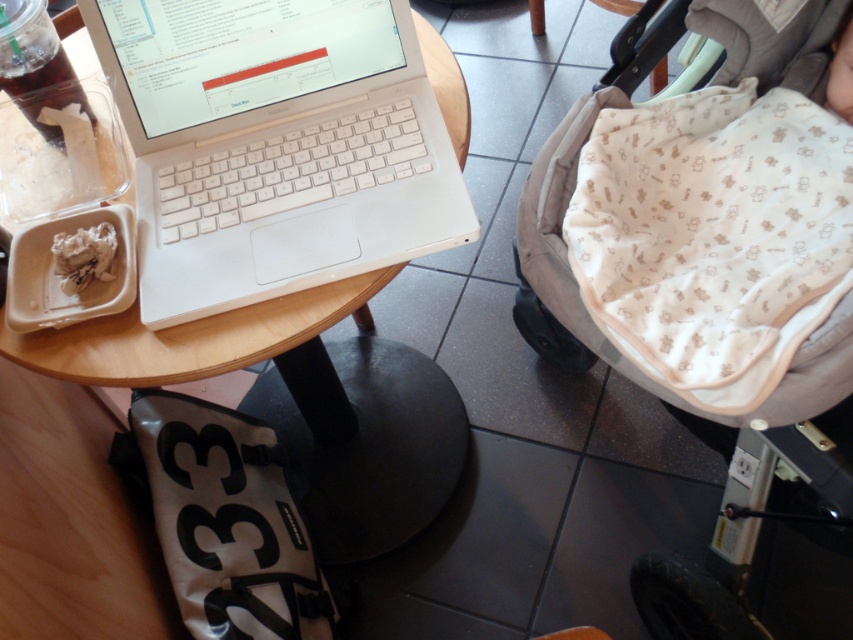
From the picture: Measure the distance between white plastic laptop at center and white crumpled paper at left.

A distance of 8.08 inches exists between white plastic laptop at center and white crumpled paper at left.

Locate an element on the screen. white plastic laptop at center is located at coordinates (276, 145).

This screenshot has height=640, width=853. I want to click on white plastic laptop at center, so point(276,145).

Locate an element on the screen. white plastic laptop at center is located at coordinates [x=276, y=145].

Between white plastic laptop at center and beige fabric baby carriage at center, which one appears on the left side from the viewer's perspective?

white plastic laptop at center

Between white plastic laptop at center and beige fabric baby carriage at center, which one is positioned lower?

beige fabric baby carriage at center is lower down.

Measure the distance between point (381, 40) and camera.

Point (381, 40) is 35.18 inches from camera.

I want to click on white plastic laptop at center, so click(276, 145).

Is beige fabric baby carriage at center thinner than white crumpled paper at left?

No.

In the scene shown: Is beige fabric baby carriage at center wider than white crumpled paper at left?

Correct, the width of beige fabric baby carriage at center exceeds that of white crumpled paper at left.

In order to click on beige fabric baby carriage at center in this screenshot , I will do `click(570, 275)`.

Where is `beige fabric baby carriage at center`? Image resolution: width=853 pixels, height=640 pixels. beige fabric baby carriage at center is located at coordinates (570, 275).